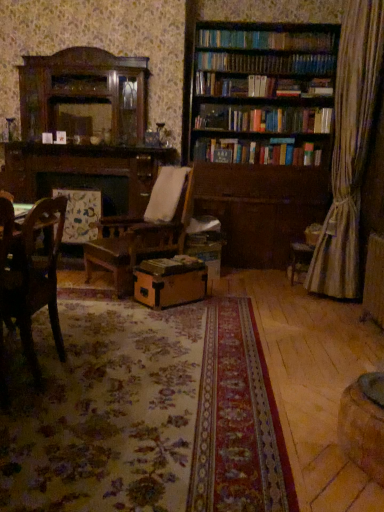
Question: Looking at their shapes, would you say brown wooden bookcase at upper right is wider or thinner than brown cardboard box at center?

Choices:
 (A) thin
 (B) wide

Answer: (B)

Question: From a real-world perspective, relative to brown cardboard box at center, is brown wooden bookcase at upper right vertically above or below?

Choices:
 (A) below
 (B) above

Answer: (B)

Question: Which object is the farthest from the wooden chair at left?

Choices:
 (A) brown cardboard box at center
 (B) brown wooden bookcase at upper right

Answer: (B)

Question: Which object is positioned closest to the brown cardboard box at center?

Choices:
 (A) brown wooden bookcase at upper right
 (B) wooden chair at left

Answer: (B)